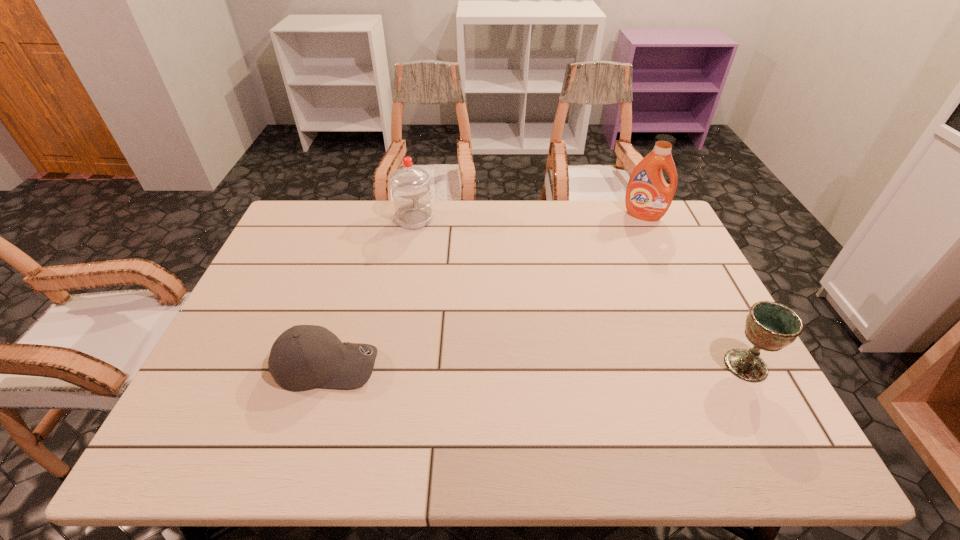
Locate an element on the screen. The image size is (960, 540). free space located on the front-facing side of the tallest object is located at coordinates (625, 253).

This screenshot has width=960, height=540. What are the coordinates of `vacant space located 0.380m on the front-facing side of the tallest object` in the screenshot? It's located at (610, 294).

The width and height of the screenshot is (960, 540). Find the location of `water bottle positioned at the far edge`. water bottle positioned at the far edge is located at coordinates (411, 193).

Where is `detergent that is at the far edge`? This screenshot has width=960, height=540. detergent that is at the far edge is located at coordinates coord(648,197).

Identify the location of baseball cap present at the near edge. (304, 357).

What are the coordinates of `chalice at the near edge` in the screenshot? It's located at (770, 326).

What are the coordinates of `object at the left edge` in the screenshot? It's located at (304, 357).

Where is `chalice situated at the right edge`? chalice situated at the right edge is located at coordinates (770, 326).

Where is `detergent located at the right edge`? detergent located at the right edge is located at coordinates (648, 197).

You are a GUI agent. You are given a task and a screenshot of the screen. Output one action in this format:
    pyautogui.click(x=<x>, y=<y>)
    Task: Click on the object at the near left corner
    
    Given the screenshot: What is the action you would take?
    pyautogui.click(x=304, y=357)